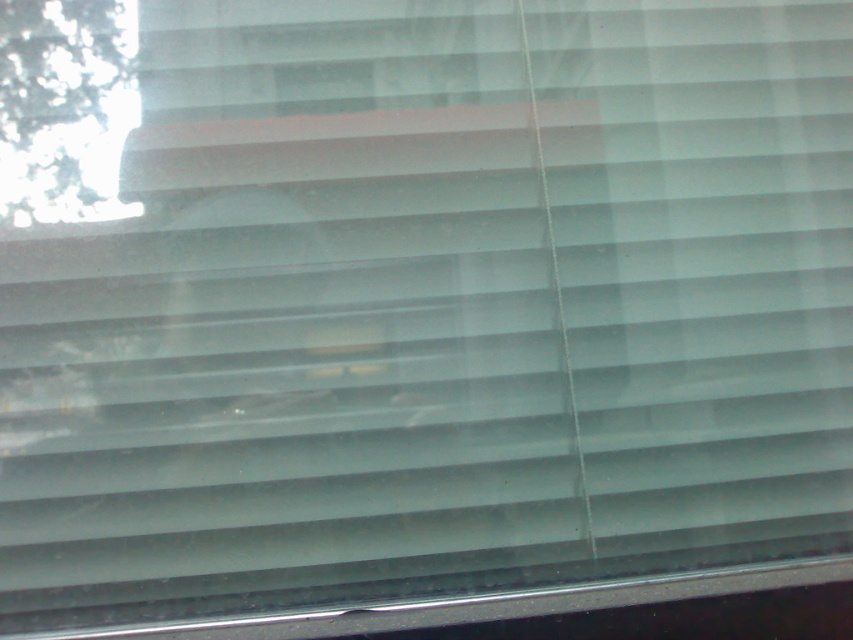
Does green leafy tree at upper left appear over metallic silver window sill at lower center?

Indeed, green leafy tree at upper left is positioned over metallic silver window sill at lower center.

Does green leafy tree at upper left have a lesser width compared to metallic silver window sill at lower center?

Correct, green leafy tree at upper left's width is less than metallic silver window sill at lower center's.

Does point (53, 132) come in front of point (659, 589)?

Yes, it is in front of point (659, 589).

This screenshot has width=853, height=640. I want to click on green leafy tree at upper left, so click(64, 108).